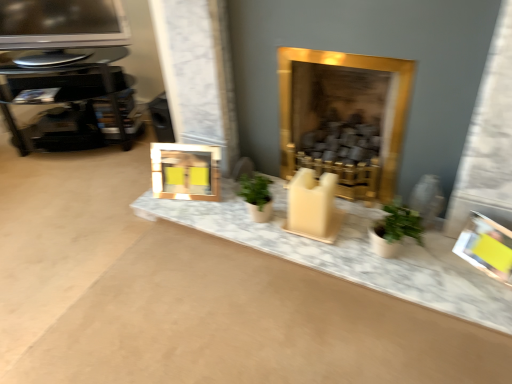
Question: Is gold metallic fireplace at center positioned behind yellow paper picture frame at right, which is the first picture frame in right-to-left order?

Choices:
 (A) yes
 (B) no

Answer: (A)

Question: From the image's perspective, would you say gold metallic fireplace at center is positioned over yellow paper picture frame at right, which is the second picture frame in left-to-right order?

Choices:
 (A) yes
 (B) no

Answer: (A)

Question: Does gold metallic fireplace at center have a smaller size compared to yellow paper picture frame at right, arranged as the 2th picture frame when viewed from the top?

Choices:
 (A) no
 (B) yes

Answer: (A)

Question: Does gold metallic fireplace at center have a lesser width compared to yellow paper picture frame at right, arranged as the 2th picture frame when viewed from the top?

Choices:
 (A) yes
 (B) no

Answer: (B)

Question: From a real-world perspective, is gold metallic fireplace at center positioned under yellow paper picture frame at right, which is the second picture frame in left-to-right order, based on gravity?

Choices:
 (A) yes
 (B) no

Answer: (B)

Question: From the image's perspective, is gold metallic fireplace at center located above or below black glass table at left?

Choices:
 (A) below
 (B) above

Answer: (A)

Question: Relative to black glass table at left, is gold metallic fireplace at center in front or behind?

Choices:
 (A) front
 (B) behind

Answer: (A)

Question: From a real-world perspective, is gold metallic fireplace at center physically located above or below black glass table at left?

Choices:
 (A) below
 (B) above

Answer: (B)

Question: From their relative heights in the image, would you say gold metallic fireplace at center is taller or shorter than black glass table at left?

Choices:
 (A) tall
 (B) short

Answer: (A)

Question: In the image, is gold metallic picture frame at center, which is the second picture frame in right-to-left order, positioned in front of or behind gold metallic fireplace at center?

Choices:
 (A) behind
 (B) front

Answer: (A)

Question: From the image's perspective, is gold metallic picture frame at center, which is counted as the 1th picture frame, starting from the left, positioned above or below gold metallic fireplace at center?

Choices:
 (A) below
 (B) above

Answer: (A)

Question: Considering the positions of gold metallic picture frame at center, the first picture frame from the top, and gold metallic fireplace at center in the image, is gold metallic picture frame at center, the first picture frame from the top, taller or shorter than gold metallic fireplace at center?

Choices:
 (A) short
 (B) tall

Answer: (A)

Question: Does point pyautogui.click(x=182, y=165) appear closer or farther from the camera than point pyautogui.click(x=410, y=89)?

Choices:
 (A) closer
 (B) farther

Answer: (B)

Question: In the image, is metallic glossy television at upper left positioned in front of or behind gold metallic picture frame at center, which is the second picture frame in right-to-left order?

Choices:
 (A) behind
 (B) front

Answer: (A)

Question: In terms of height, does metallic glossy television at upper left look taller or shorter compared to gold metallic picture frame at center, which is the second picture frame in right-to-left order?

Choices:
 (A) short
 (B) tall

Answer: (B)